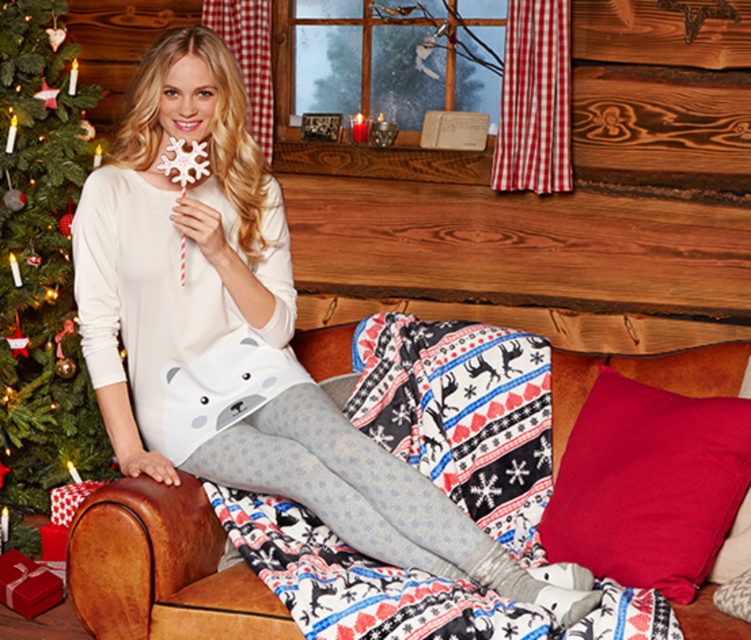
You are a guest at a holiday party and see the matte white pajama set at center and the brown leather couch at center. Which item is bigger in size?

The matte white pajama set at center is larger in size compared to the brown leather couch at center.

You are a guest in this living room and want to sit down. The brown leather couch at center and the velvety red cushion at lower right are both available. Which one would you choose if you prefer something taller to sit on?

You should choose the brown leather couch at center because it is much taller than the velvety red cushion at lower right.

You are a guest at a holiday party and see the matte white pajama set at center and the brown leather couch at center. Which object is covering the other?

The matte white pajama set at center is positioned over the brown leather couch at center, meaning the pajama set is covering the couch.